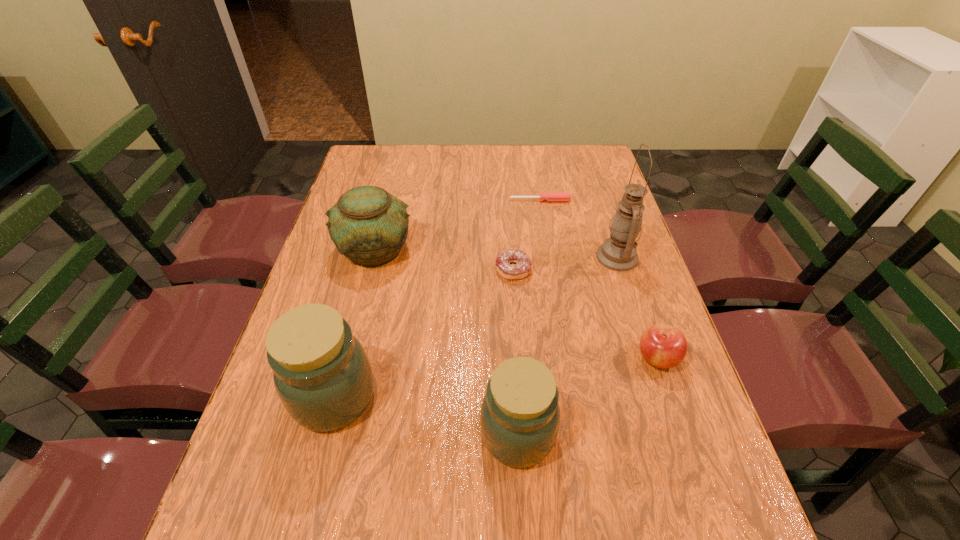
Identify the location of free location located 0.240m on the back of the right jar. The height and width of the screenshot is (540, 960). (510, 313).

At what (x,y) coordinates should I click in order to perform the action: click on vacant space located on the right of the sixth tallest object. Please return your answer as a coordinate pair (x, y). The height and width of the screenshot is (540, 960). Looking at the image, I should click on (596, 270).

Locate an element on the screen. vacant space located 0.110m on the back of the screwdriver is located at coordinates (537, 180).

This screenshot has width=960, height=540. Find the location of `vacant space located 0.070m on the back of the oil lamp`. vacant space located 0.070m on the back of the oil lamp is located at coordinates (607, 226).

Locate an element on the screen. vacant space located 0.220m on the right of the pottery is located at coordinates (492, 250).

This screenshot has width=960, height=540. In order to click on vacant region located 0.150m on the left of the third shortest object in this screenshot , I will do `click(570, 358)`.

The height and width of the screenshot is (540, 960). I want to click on object present at the near edge, so click(520, 415).

At what (x,y) coordinates should I click in order to perform the action: click on jar present at the left edge. Please return your answer as a coordinate pair (x, y). Image resolution: width=960 pixels, height=540 pixels. Looking at the image, I should click on (322, 375).

At what (x,y) coordinates should I click in order to perform the action: click on pottery that is at the left edge. Please return your answer as a coordinate pair (x, y). The height and width of the screenshot is (540, 960). Looking at the image, I should click on (368, 225).

Where is `screwdriver present at the right edge`? Image resolution: width=960 pixels, height=540 pixels. screwdriver present at the right edge is located at coordinates (550, 196).